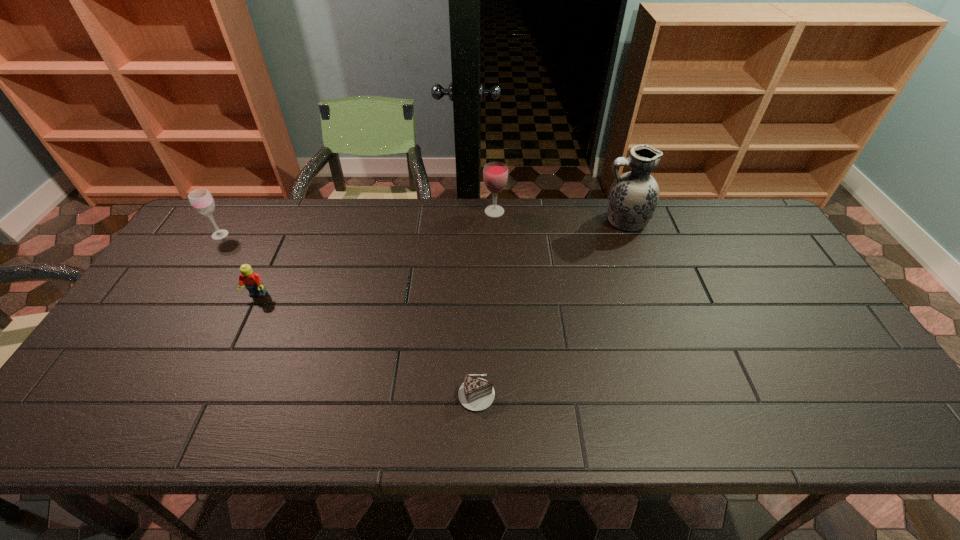
I want to click on free space between the second nearest object and the right wineglass, so click(x=376, y=253).

You are a GUI agent. You are given a task and a screenshot of the screen. Output one action in this format:
    pyautogui.click(x=<x>, y=<y>)
    Task: Click on the free area in between the Lego and the vase
    This screenshot has height=540, width=960.
    Given the screenshot: What is the action you would take?
    pyautogui.click(x=441, y=258)

Locate an element on the screen. This screenshot has height=540, width=960. free space between the left wineglass and the tallest object is located at coordinates (422, 228).

This screenshot has height=540, width=960. Find the location of `blank region between the vase and the fourth object from right to left`. blank region between the vase and the fourth object from right to left is located at coordinates (441, 258).

At what (x,y) coordinates should I click in order to perform the action: click on empty space that is in between the nearer wineglass and the right wineglass. Please return your answer as a coordinate pair (x, y). This screenshot has height=540, width=960. Looking at the image, I should click on (357, 223).

The width and height of the screenshot is (960, 540). What are the coordinates of `object that can be found as the second closest to the Lego` in the screenshot? It's located at (476, 394).

Point out which object is positioned as the nearest to the left wineglass. Please provide its 2D coordinates. Your answer should be formatted as a tuple, i.e. [(x, y)], where the tuple contains the x and y coordinates of a point satisfying the conditions above.

[(252, 281)]